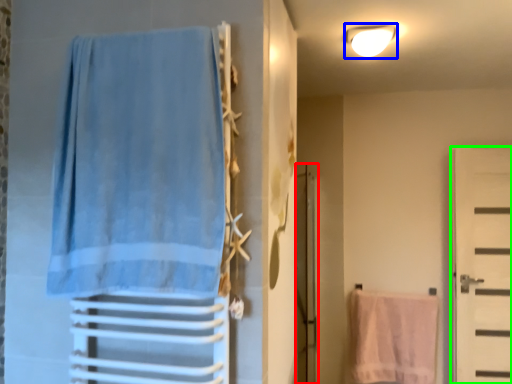
Question: Which object is the closest to the screen door (highlighted by a red box)? Choose among these: light fixture (highlighted by a blue box) or door (highlighted by a green box).

Choices:
 (A) light fixture
 (B) door

Answer: (A)